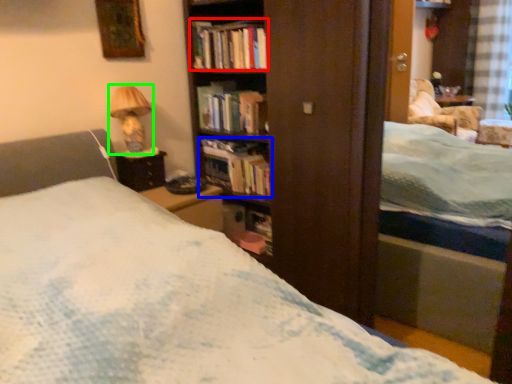
Question: Which object is the farthest from book (highlighted by a red box)? Choose among these: book (highlighted by a blue box) or table lamp (highlighted by a green box).

Choices:
 (A) book
 (B) table lamp

Answer: (A)